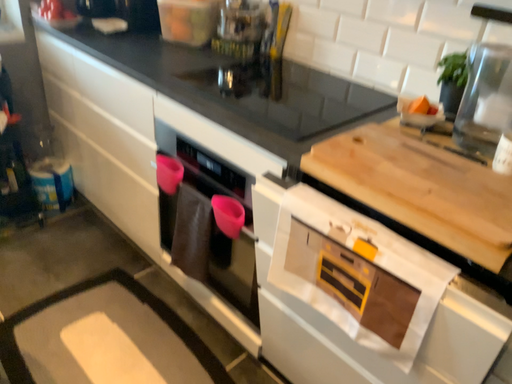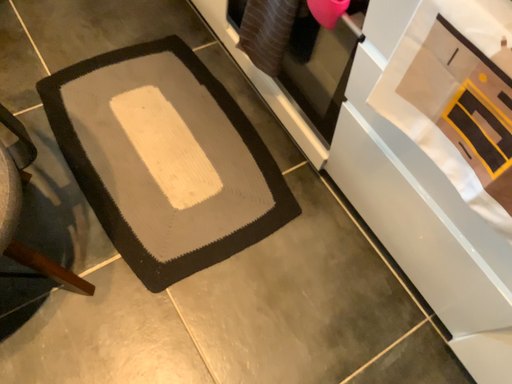
Question: Which way did the camera rotate in the video?

Choices:
 (A) rotated left
 (B) rotated right

Answer: (A)